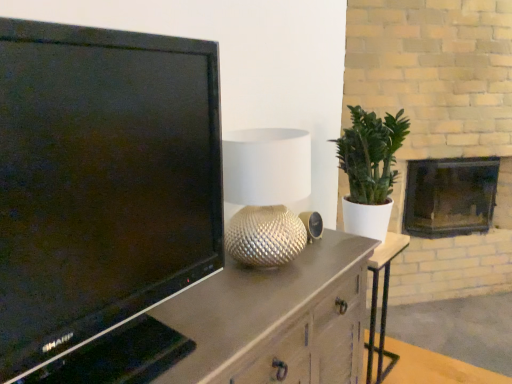
Question: Should I look upward or downward to see black glossy television at left?

Choices:
 (A) down
 (B) up

Answer: (A)

Question: From the image's perspective, is dark gray stone fireplace at right over silver textured lamp at center?

Choices:
 (A) no
 (B) yes

Answer: (B)

Question: Does dark gray stone fireplace at right have a lesser width compared to silver textured lamp at center?

Choices:
 (A) no
 (B) yes

Answer: (A)

Question: From a real-world perspective, is dark gray stone fireplace at right located beneath silver textured lamp at center?

Choices:
 (A) no
 (B) yes

Answer: (B)

Question: Considering the relative sizes of dark gray stone fireplace at right and silver textured lamp at center in the image provided, is dark gray stone fireplace at right taller than silver textured lamp at center?

Choices:
 (A) yes
 (B) no

Answer: (A)

Question: Is dark gray stone fireplace at right turned away from silver textured lamp at center?

Choices:
 (A) yes
 (B) no

Answer: (B)

Question: Does dark gray stone fireplace at right have a greater width compared to silver textured lamp at center?

Choices:
 (A) yes
 (B) no

Answer: (A)

Question: Is dark gray stone fireplace at right positioned behind black glossy television at left?

Choices:
 (A) yes
 (B) no

Answer: (A)

Question: Does dark gray stone fireplace at right lie in front of black glossy television at left?

Choices:
 (A) no
 (B) yes

Answer: (A)

Question: Considering the relative positions of dark gray stone fireplace at right and black glossy television at left in the image provided, is dark gray stone fireplace at right to the right of black glossy television at left from the viewer's perspective?

Choices:
 (A) yes
 (B) no

Answer: (A)

Question: Can you confirm if dark gray stone fireplace at right is positioned to the left of black glossy television at left?

Choices:
 (A) yes
 (B) no

Answer: (B)

Question: From the image's perspective, does dark gray stone fireplace at right appear lower than black glossy television at left?

Choices:
 (A) no
 (B) yes

Answer: (A)

Question: From a real-world perspective, is dark gray stone fireplace at right over black glossy television at left?

Choices:
 (A) yes
 (B) no

Answer: (B)

Question: Is matte brown cabinet at left positioned before dark gray stone fireplace at right?

Choices:
 (A) no
 (B) yes

Answer: (B)